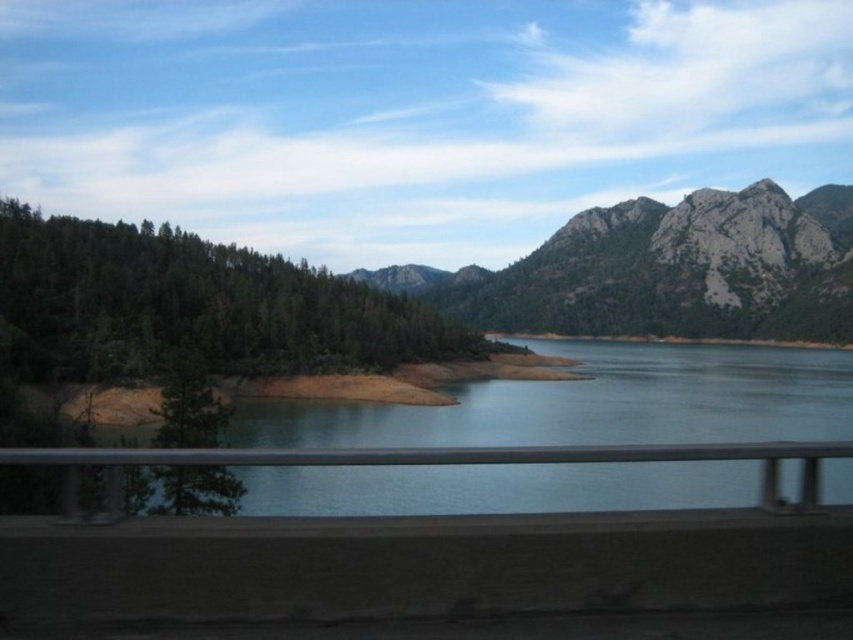
Question: Is green matte forest at left positioned at the back of gray rocky mountain at upper right?

Choices:
 (A) no
 (B) yes

Answer: (A)

Question: Is gray rocky mountain at upper right further to camera compared to green matte tree at lower left?

Choices:
 (A) no
 (B) yes

Answer: (B)

Question: Which object is farther from the camera taking this photo?

Choices:
 (A) green matte forest at left
 (B) gray rocky mountain at upper right

Answer: (B)

Question: Considering the real-world distances, which object is farthest from the green matte forest at left?

Choices:
 (A) gray rocky mountain at upper right
 (B) green matte tree at lower left

Answer: (A)

Question: Does gray rocky mountain at upper right have a smaller size compared to green matte tree at lower left?

Choices:
 (A) yes
 (B) no

Answer: (B)

Question: Which is farther from the gray rocky mountain at upper right?

Choices:
 (A) green matte forest at left
 (B) green matte tree at lower left

Answer: (B)